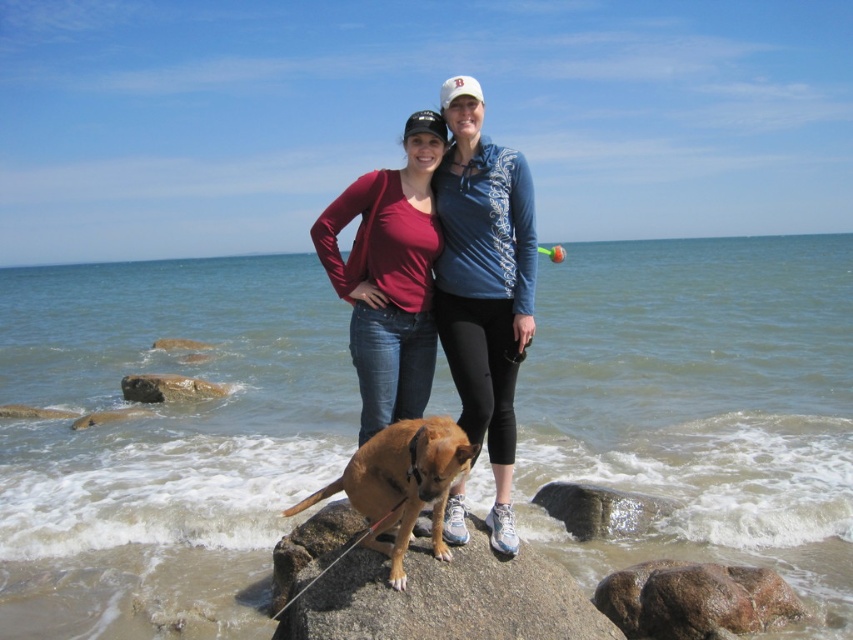
Can you confirm if matte blue hoodie at center is positioned below smooth gray rock at lower right?

Actually, matte blue hoodie at center is above smooth gray rock at lower right.

This screenshot has width=853, height=640. I want to click on matte blue hoodie at center, so click(x=485, y=284).

Which is in front, point (453, 196) or point (598, 484)?

Point (453, 196) is in front.

Where is `matte blue hoodie at center`? Image resolution: width=853 pixels, height=640 pixels. matte blue hoodie at center is located at coordinates (485, 284).

Who is higher up, brown smooth rock at center or brown furry dog at center?

brown furry dog at center

Can you confirm if brown smooth rock at center is positioned to the right of brown furry dog at center?

Yes, brown smooth rock at center is to the right of brown furry dog at center.

Is point (316, 592) positioned after point (364, 467)?

Yes, point (316, 592) is behind point (364, 467).

Find the location of a particular element. The height and width of the screenshot is (640, 853). brown smooth rock at center is located at coordinates (445, 596).

Who is positioned more to the left, brown smooth rock at center or smooth gray rock at lower right?

brown smooth rock at center

Can you confirm if brown smooth rock at center is smaller than smooth gray rock at lower right?

No.

Is point (363, 564) positioned behind point (584, 516)?

No, it is not.

The height and width of the screenshot is (640, 853). Find the location of `brown smooth rock at center`. brown smooth rock at center is located at coordinates (x=445, y=596).